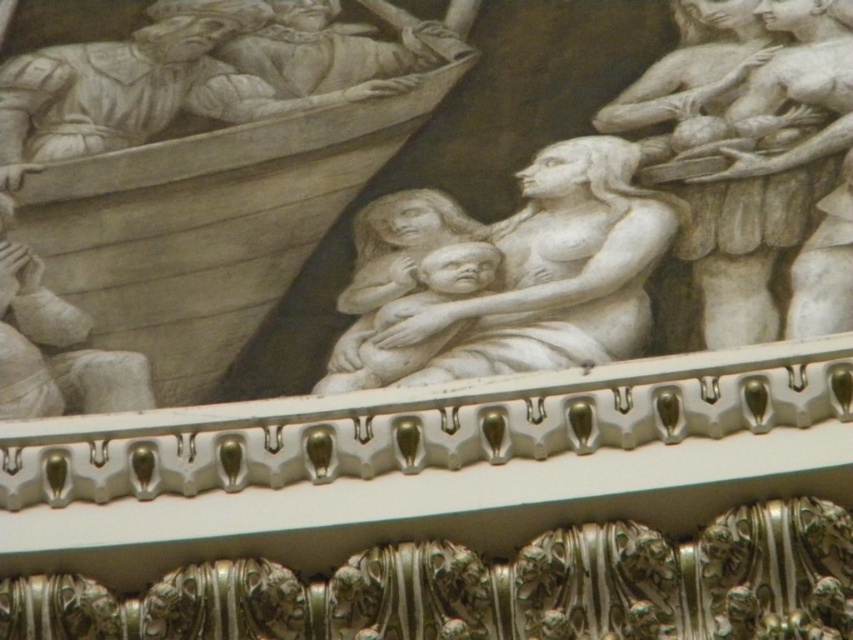
Question: Does wooden boat at center appear under polished bronze relief at center?

Choices:
 (A) no
 (B) yes

Answer: (A)

Question: Is wooden boat at center bigger than white marble sculpture at center?

Choices:
 (A) no
 (B) yes

Answer: (B)

Question: Estimate the real-world distances between objects in this image. Which object is closer to the wooden boat at center?

Choices:
 (A) white marble woman holding child at upper right
 (B) white marble boat at upper left

Answer: (B)

Question: Which of these objects is positioned closest to the matte gray stone boat at left?

Choices:
 (A) white marble boat at upper left
 (B) white marble sculpture at center
 (C) white marble woman holding child at upper right

Answer: (B)

Question: Is white marble woman holding child at upper right above matte gray stone boat at left?

Choices:
 (A) yes
 (B) no

Answer: (A)

Question: Which of the following is the farthest from the observer?

Choices:
 (A) wooden boat at center
 (B) white marble sculpture at center
 (C) polished bronze relief at center

Answer: (A)